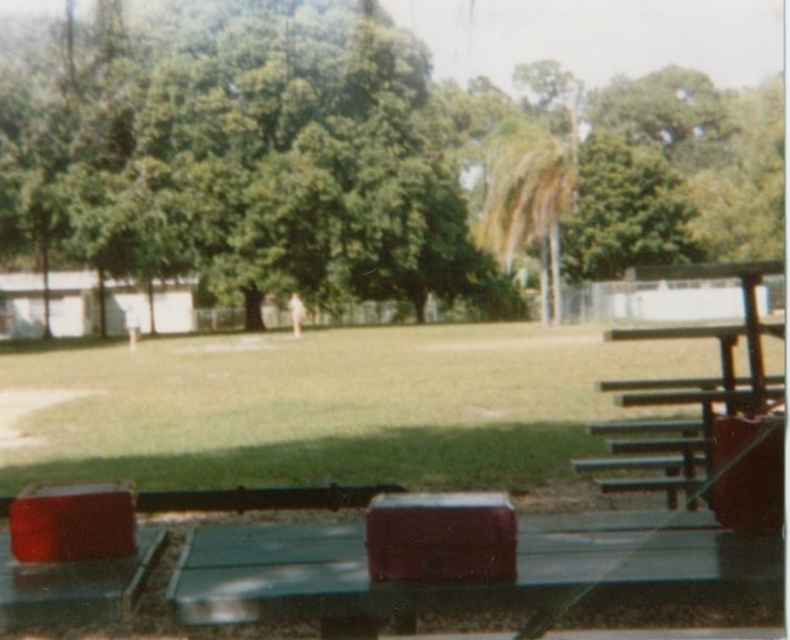
Question: Does metallic green picnic table at lower center appear on the right side of green metal picnic table at right?

Choices:
 (A) yes
 (B) no

Answer: (B)

Question: Is green leafy tree at upper left to the left of green metal picnic table at right from the viewer's perspective?

Choices:
 (A) yes
 (B) no

Answer: (A)

Question: Observing the image, what is the correct spatial positioning of green grass at center in reference to metallic green picnic table at lower center?

Choices:
 (A) above
 (B) below

Answer: (A)

Question: Which object appears farthest from the camera in this image?

Choices:
 (A) green grass at center
 (B) green metal picnic table at right

Answer: (A)

Question: Which object appears closest to the camera in this image?

Choices:
 (A) metallic green picnic table at lower center
 (B) green metal picnic table at right
 (C) green grass at center
 (D) green leafy tree at upper left

Answer: (A)

Question: Which of the following is the farthest from the observer?

Choices:
 (A) (333, 364)
 (B) (757, 387)

Answer: (A)